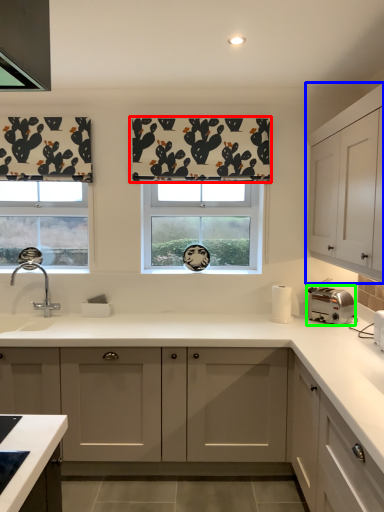
Question: Considering the real-world distances, which object is farthest from curtain (highlighted by a red box)? cabinetry (highlighted by a blue box) or toaster (highlighted by a green box)?

Choices:
 (A) cabinetry
 (B) toaster

Answer: (B)